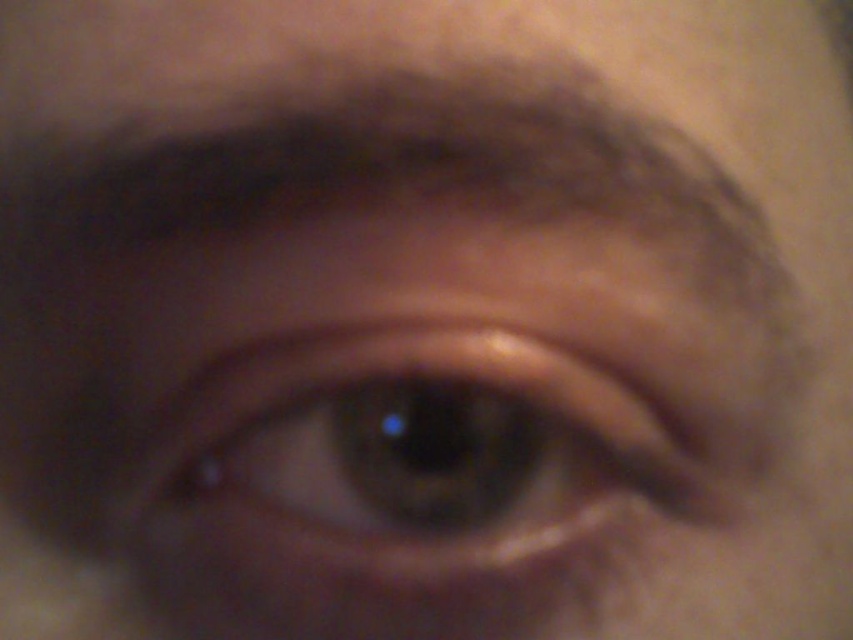
Question: Which object appears closest to the camera in this image?

Choices:
 (A) brown matte eye at center
 (B) dark brown hair at upper center

Answer: (B)

Question: Observing the image, what is the correct spatial positioning of brown matte eye at center in reference to dark brown hair at upper center?

Choices:
 (A) left
 (B) right

Answer: (B)

Question: Can you confirm if brown matte eye at center is thinner than dark brown hair at upper center?

Choices:
 (A) yes
 (B) no

Answer: (A)

Question: Can you confirm if brown matte eye at center is positioned below dark brown hair at upper center?

Choices:
 (A) yes
 (B) no

Answer: (A)